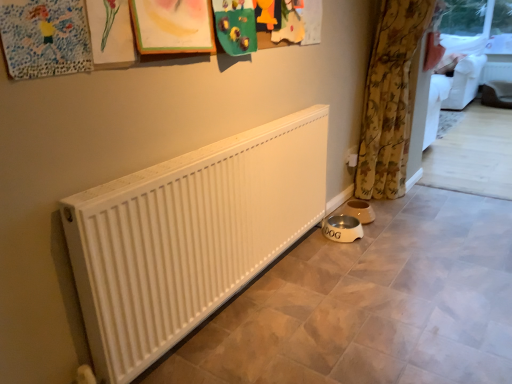
This screenshot has height=384, width=512. What do you see at coordinates (390, 99) in the screenshot?
I see `floral fabric curtain at right` at bounding box center [390, 99].

This screenshot has height=384, width=512. In order to click on floral fabric curtain at right in this screenshot , I will do `click(390, 99)`.

Measure the distance between point (x=365, y=177) and camera.

A distance of 8.77 feet exists between point (x=365, y=177) and camera.

I want to click on floral fabric curtain at right, so click(390, 99).